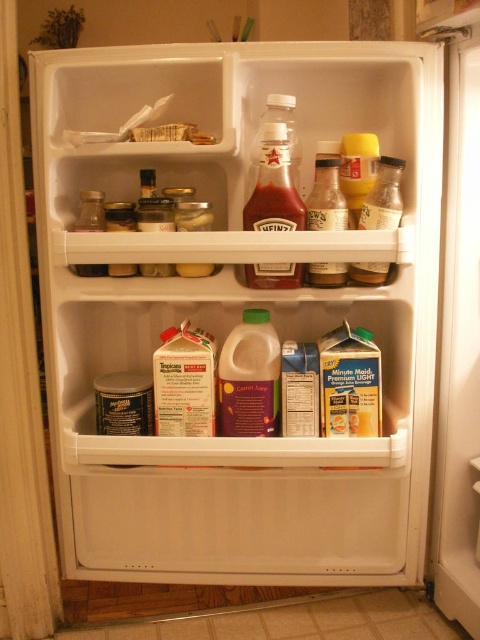
Can you confirm if translucent glass bottles at center is positioned to the left of translucent glass jar at upper right?

Indeed, translucent glass bottles at center is positioned on the left side of translucent glass jar at upper right.

Between translucent glass bottles at center and translucent glass jar at upper right, which one is positioned higher?

translucent glass bottles at center

Which is in front, point (331, 179) or point (372, 204)?

Point (372, 204)

You are a GUI agent. You are given a task and a screenshot of the screen. Output one action in this format:
    pyautogui.click(x=<x>, y=<y>)
    Task: Click on the translucent glass bottles at center
    
    Given the screenshot: What is the action you would take?
    pyautogui.click(x=326, y=192)

Is translucent glass bottles at center smaller than translucent plastic bottle at center?

Yes, translucent glass bottles at center is smaller than translucent plastic bottle at center.

Can you confirm if translucent glass bottles at center is wider than translucent plastic bottle at center?

In fact, translucent glass bottles at center might be narrower than translucent plastic bottle at center.

Which is behind, point (333, 273) or point (289, 166)?

Point (333, 273)

This screenshot has width=480, height=640. What are the coordinates of `translucent glass bottles at center` in the screenshot? It's located at point(326,192).

Does matte glass bottle of ketchup at center have a larger size compared to translucent plastic bottle at center?

Incorrect, matte glass bottle of ketchup at center is not larger than translucent plastic bottle at center.

Is matte glass bottle of ketchup at center to the left of translucent plastic bottle at center from the viewer's perspective?

Indeed, matte glass bottle of ketchup at center is positioned on the left side of translucent plastic bottle at center.

At what (x,y) coordinates should I click in order to perform the action: click on matte glass bottle of ketchup at center. Please return your answer as a coordinate pair (x, y). The width and height of the screenshot is (480, 640). Looking at the image, I should click on (274, 209).